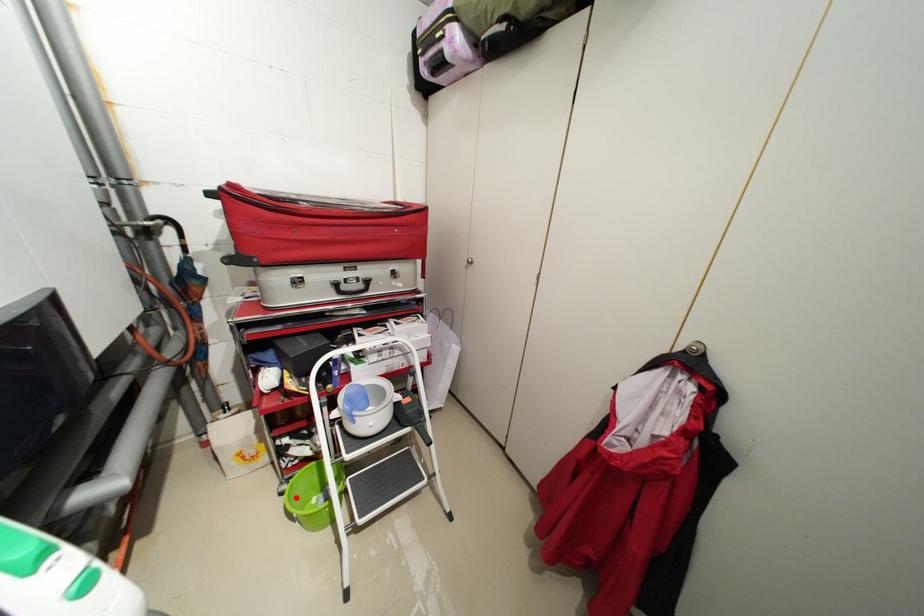
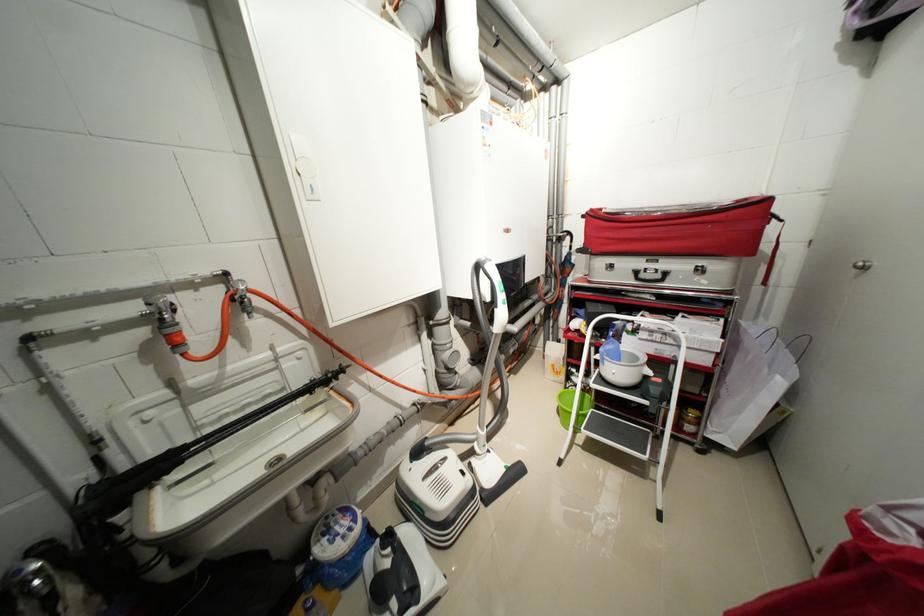
Locate, in the second image, the point that corresponds to the highlighted location in the first image.

(566, 397)